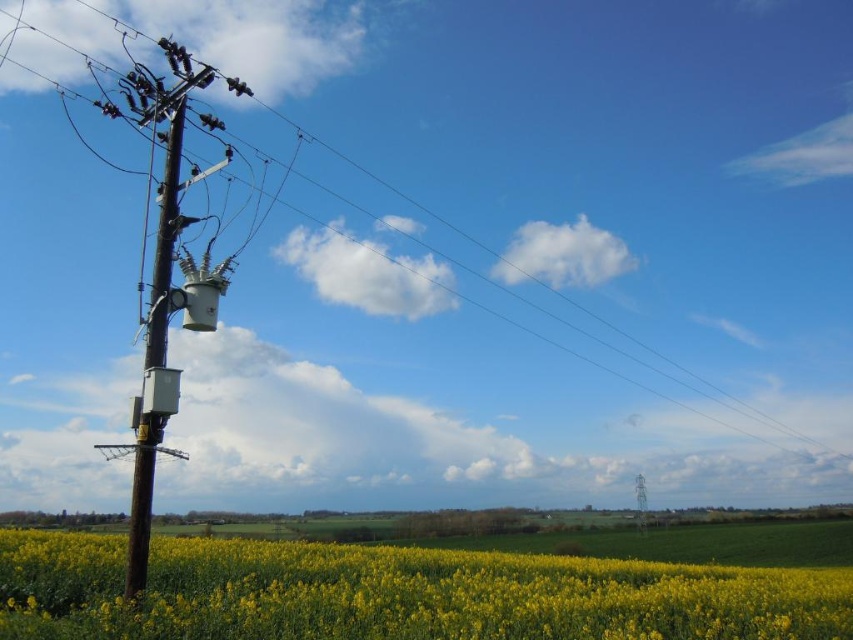
You are a painter planning to capture this rural landscape. You want to ensure that both the brown metallic pole at left and the brown wooden pole at left are visible in your painting. Given their heights, which pole should you position closer to the center to ensure both are adequately framed?

The brown metallic pole at left is taller than the brown wooden pole at left. To ensure both are adequately framed, position the shorter brown wooden pole at left closer to the center so its smaller size doesn

You are a painter standing in the middle of the yellow flower field. You want to paint both the brown metallic pole at left and the brown wooden telegraph pole at left. Which pole should you move closer to if you want both to appear equally tall in your painting?

The brown metallic pole at left is taller than the brown wooden telegraph pole at left. To make them appear equally tall in the painting, you should move closer to the brown wooden telegraph pole at left since it is shorter and needs to be magnified more in the painting.

From the picture: You are a painter setting up your easel in the field of vibrant yellow flowers. You want to paint both the brown wooden telegraph pole at left and the brown wooden pole at left. Which pole should you move closer to if you want to paint the one that is thinner?

The brown wooden telegraph pole at left has a lesser width compared to the brown wooden pole at left, so you should move closer to the brown wooden telegraph pole at left to paint the thinner one.